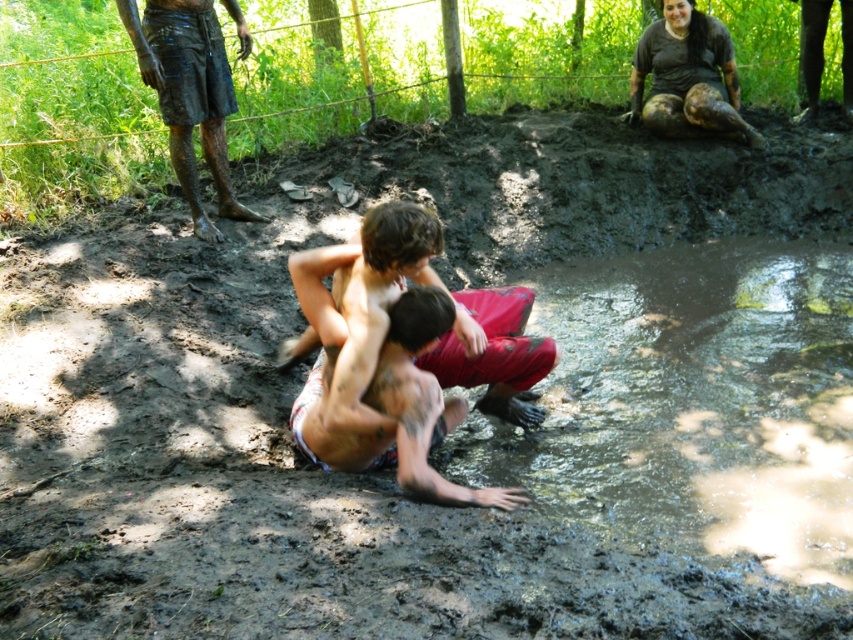
Consider the image. Can you confirm if muddy shorts at upper left is positioned to the left of muddy skin at upper center?

Yes, muddy shorts at upper left is to the left of muddy skin at upper center.

Is muddy shorts at upper left taller than muddy skin at upper center?

Indeed, muddy shorts at upper left has a greater height compared to muddy skin at upper center.

Between point (138, 28) and point (660, 134), which one is positioned behind?

The point (660, 134) is more distant.

I want to click on muddy shorts at upper left, so click(x=189, y=93).

Between shiny skin child at center and muddy shorts at upper left, which one appears on the left side from the viewer's perspective?

muddy shorts at upper left

Does shiny skin child at center appear under muddy shorts at upper left?

Correct, shiny skin child at center is located below muddy shorts at upper left.

You are a GUI agent. You are given a task and a screenshot of the screen. Output one action in this format:
    pyautogui.click(x=<x>, y=<y>)
    Task: Click on the shiny skin child at center
    The height and width of the screenshot is (640, 853).
    Given the screenshot: What is the action you would take?
    pyautogui.click(x=492, y=353)

Can you confirm if shiny skin squat at center is positioned below muddy shorts at upper left?

Indeed, shiny skin squat at center is positioned under muddy shorts at upper left.

Is point (401, 346) more distant than point (215, 180)?

That is False.

At what (x,y) coordinates should I click in order to perform the action: click on shiny skin squat at center. Please return your answer as a coordinate pair (x, y). Image resolution: width=853 pixels, height=640 pixels. Looking at the image, I should click on (397, 410).